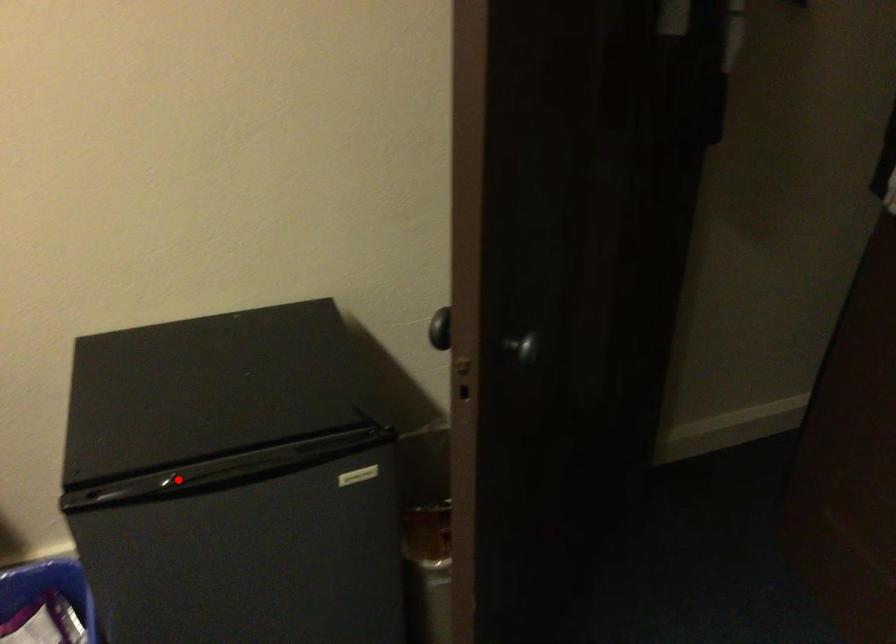
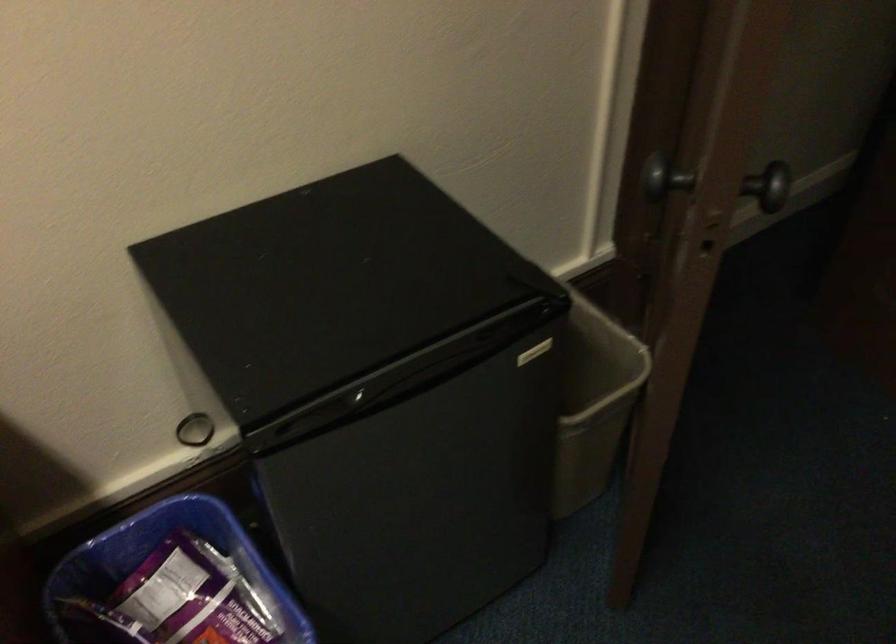
Question: A red point is marked in image1. In image2, is the corresponding 3D point closer to the camera or farther? Reply with the corresponding letter.

Choices:
 (A) The corresponding 3D point is closer.
 (B) The corresponding 3D point is farther.

Answer: (A)